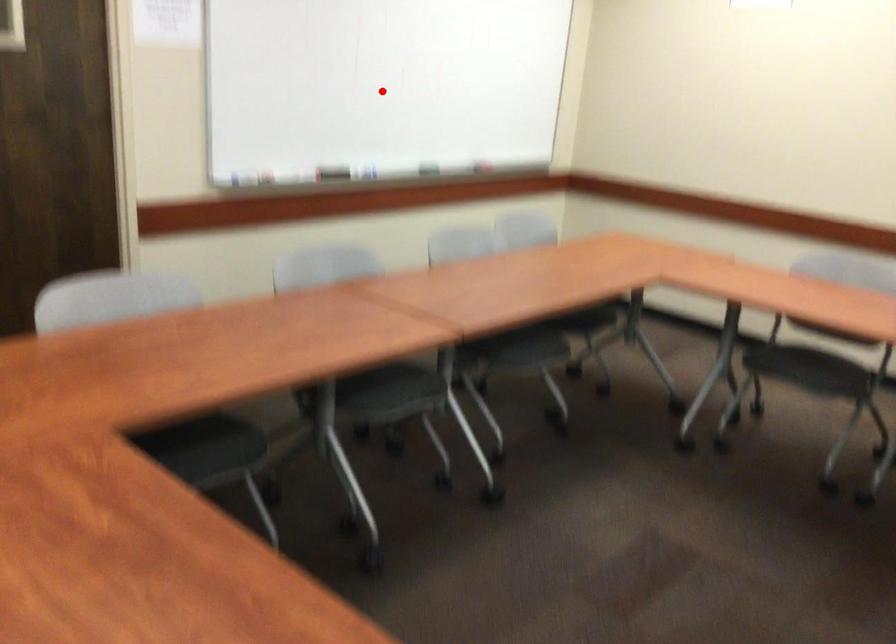
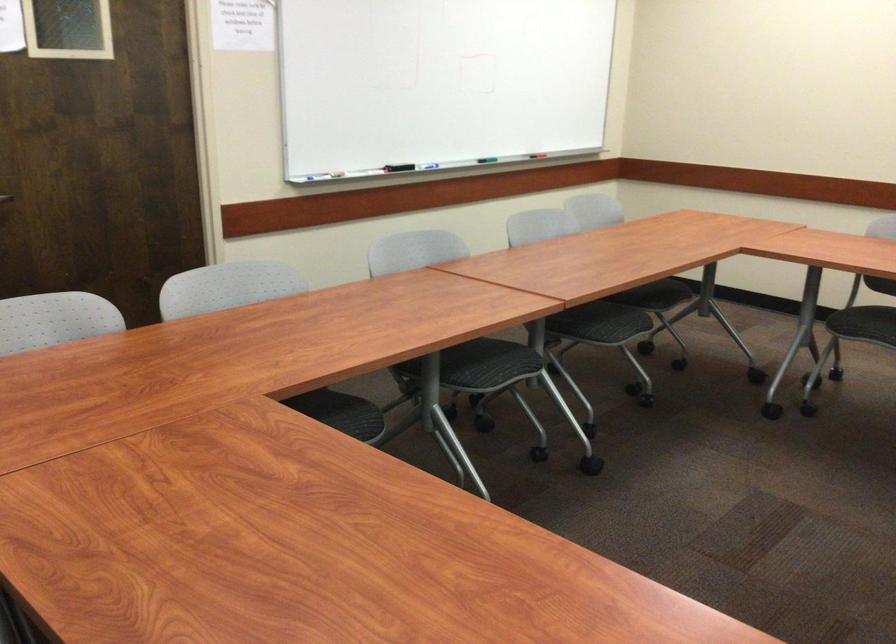
Where in the second image is the point corresponding to the highlighted location from the first image?

(438, 82)